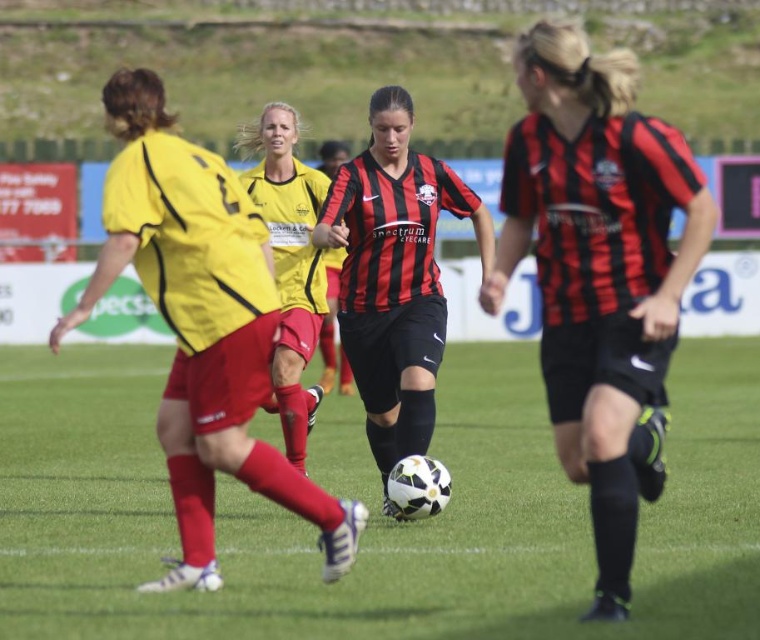
Does point (133, 150) lie behind point (257, 202)?

No, (133, 150) is in front of (257, 202).

Can you confirm if yellow matte jersey at center is wider than yellow jersey at center?

Yes.

Which is in front, point (179, 282) or point (268, 186)?

Point (179, 282) is in front.

The width and height of the screenshot is (760, 640). I want to click on yellow matte jersey at center, so click(201, 324).

Does matte black shorts at center come behind yellow matte jersey at center?

No, matte black shorts at center is in front of yellow matte jersey at center.

Does matte black shorts at center appear on the left side of yellow matte jersey at center?

No, matte black shorts at center is not to the left of yellow matte jersey at center.

You are a GUI agent. You are given a task and a screenshot of the screen. Output one action in this format:
    pyautogui.click(x=<x>, y=<y>)
    Task: Click on the matte black shorts at center
    The height and width of the screenshot is (640, 760).
    Given the screenshot: What is the action you would take?
    pyautogui.click(x=599, y=273)

Between green grass football field at center and black matte soccer ball at center, which one is positioned lower?

green grass football field at center is below.

Which is more to the left, green grass football field at center or black matte soccer ball at center?

black matte soccer ball at center

Identify the location of green grass football field at center. (372, 513).